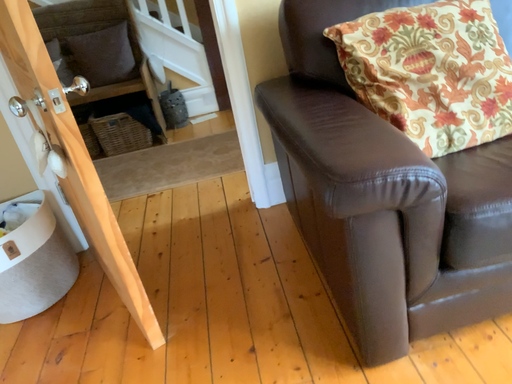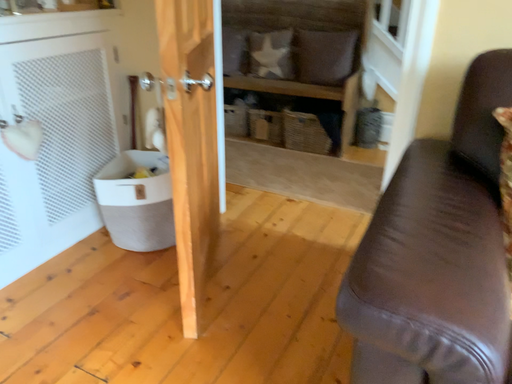
Question: Which way did the camera rotate in the video?

Choices:
 (A) rotated upward
 (B) rotated downward

Answer: (A)